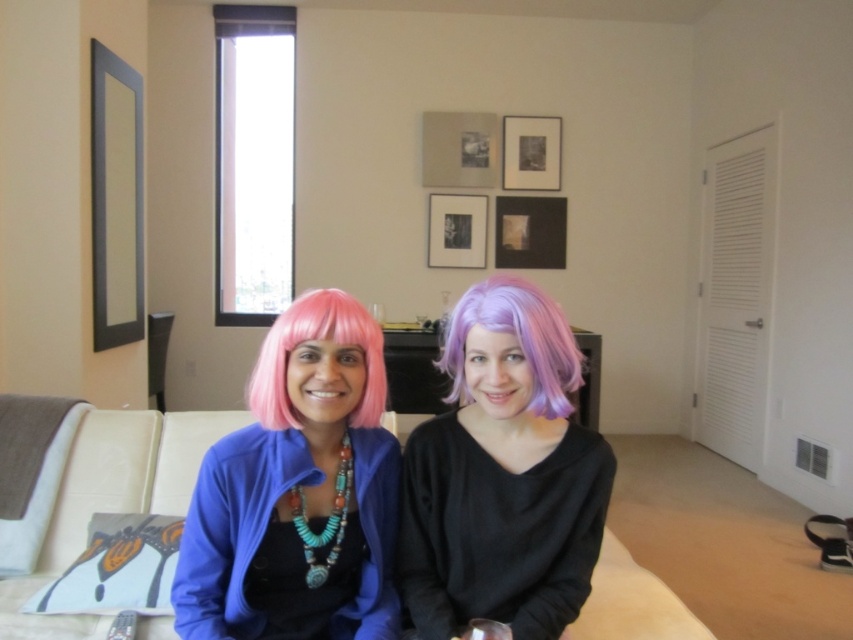
You are a stylist preparing to style two purple wigs for a photoshoot. You have the purple matte wig at center and the purple silky wig at center. Which wig should you choose if you want the one that stands taller?

The purple matte wig at center has a greater height compared to the purple silky wig at center, so you should choose the purple matte wig at center for the photoshoot if you want the taller option.

You are a photographer setting up a shoot in this living room. You need to place a 30 inch wide camera tripod between the beige fabric couch at center and the pink synthetic wig at center. Is there enough space to fit the tripod without moving either object?

The beige fabric couch at center and pink synthetic wig at center are 32.30 inches apart. Since the tripod is 30 inches wide, there is enough space to place it between them without moving either object.

You are a photographer setting up a shoot in a living room. You need to place a light source to highlight the beige fabric couch at center and the pink synthetic wig at center. Since the window is already providing natural light, where should you place the additional light to avoid shadows between them?

The beige fabric couch at center is positioned under the pink synthetic wig at center, so placing the light source above and slightly behind the subjects will ensure even lighting without casting shadows between them.